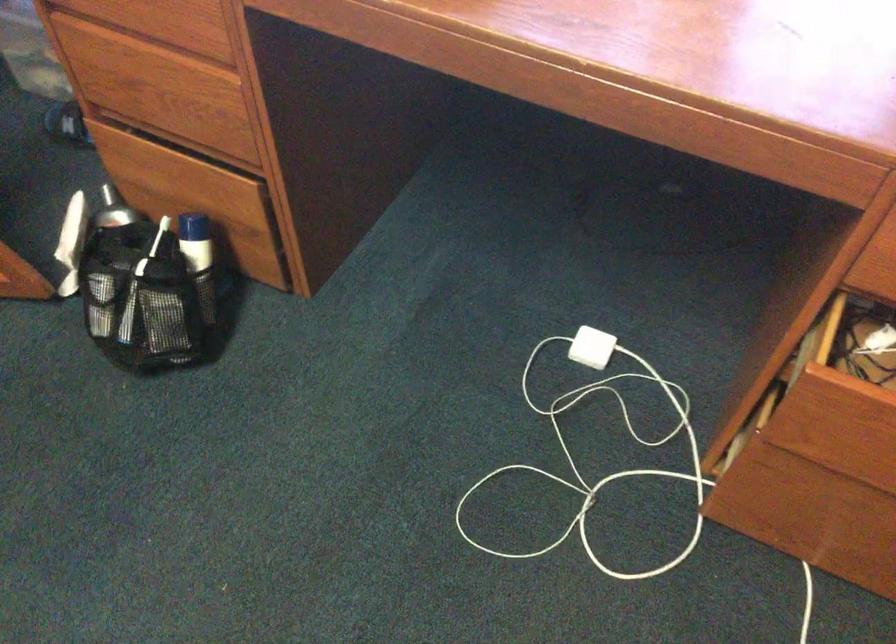
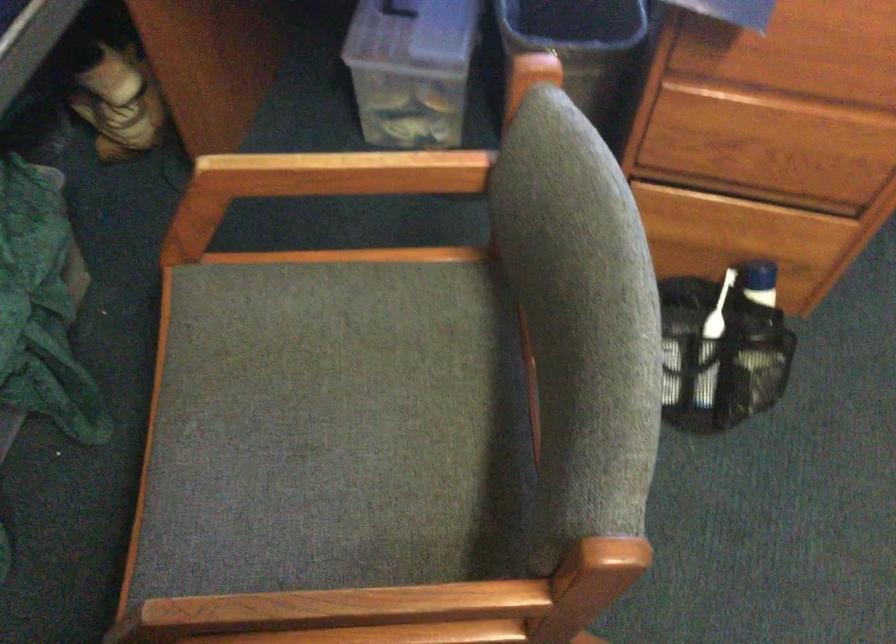
In the second image, find the point that corresponds to [197,259] in the first image.

(757, 303)